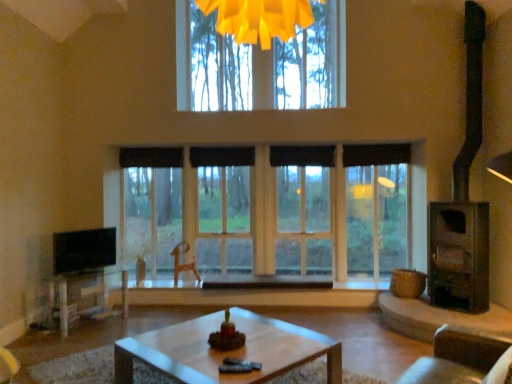
Question: Can we say clear glass window at center lies outside black fabric curtain at center, marked as the 2th curtain in a right-to-left arrangement?

Choices:
 (A) yes
 (B) no

Answer: (A)

Question: Is clear glass window at center bigger than black fabric curtain at center, which is the 3th curtain in left-to-right order?

Choices:
 (A) yes
 (B) no

Answer: (A)

Question: From a real-world perspective, is clear glass window at center below black fabric curtain at center, marked as the 2th curtain in a right-to-left arrangement?

Choices:
 (A) no
 (B) yes

Answer: (B)

Question: Is clear glass window at center at the left side of black fabric curtain at center, marked as the 2th curtain in a right-to-left arrangement?

Choices:
 (A) yes
 (B) no

Answer: (A)

Question: From a real-world perspective, is clear glass window at center on top of black fabric curtain at center, marked as the 2th curtain in a right-to-left arrangement?

Choices:
 (A) no
 (B) yes

Answer: (A)

Question: Is clear glass window at center further to the viewer compared to black fabric curtain at center, marked as the 2th curtain in a right-to-left arrangement?

Choices:
 (A) no
 (B) yes

Answer: (A)

Question: Is black fabric curtain at upper center, the 4th curtain when ordered from left to right, wider than black matte curtain at upper center, acting as the fourth curtain starting from the right?

Choices:
 (A) yes
 (B) no

Answer: (B)

Question: From the image's perspective, is black fabric curtain at upper center, the 4th curtain when ordered from left to right, located beneath black matte curtain at upper center, the 1th curtain viewed from the left?

Choices:
 (A) no
 (B) yes

Answer: (A)

Question: Are black fabric curtain at upper center, the 4th curtain when ordered from left to right, and black matte curtain at upper center, the 1th curtain viewed from the left, far apart?

Choices:
 (A) yes
 (B) no

Answer: (A)

Question: Can you confirm if black fabric curtain at upper center, positioned as the first curtain in right-to-left order, is positioned to the left of black matte curtain at upper center, the 1th curtain viewed from the left?

Choices:
 (A) no
 (B) yes

Answer: (A)

Question: Is black fabric curtain at upper center, positioned as the first curtain in right-to-left order, looking in the opposite direction of black matte curtain at upper center, the 1th curtain viewed from the left?

Choices:
 (A) yes
 (B) no

Answer: (B)

Question: Does black fabric curtain at upper center, the 4th curtain when ordered from left to right, come behind black matte curtain at upper center, the 1th curtain viewed from the left?

Choices:
 (A) yes
 (B) no

Answer: (B)

Question: From the image's perspective, is black matte curtain at upper center, acting as the fourth curtain starting from the right, located beneath dark gray metallic fireplace at right?

Choices:
 (A) yes
 (B) no

Answer: (B)